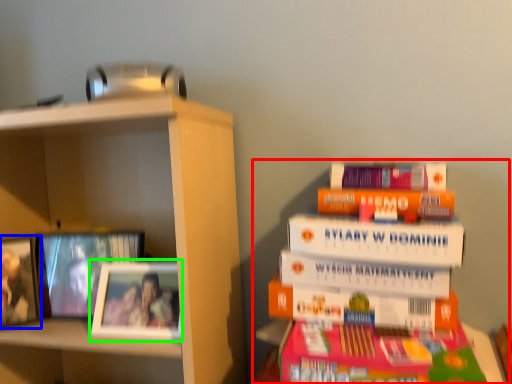
Question: Estimate the real-world distances between objects in this image. Which object is farther from book (highlighted by a red box), picture frame (highlighted by a blue box) or picture frame (highlighted by a green box)?

Choices:
 (A) picture frame
 (B) picture frame

Answer: (A)